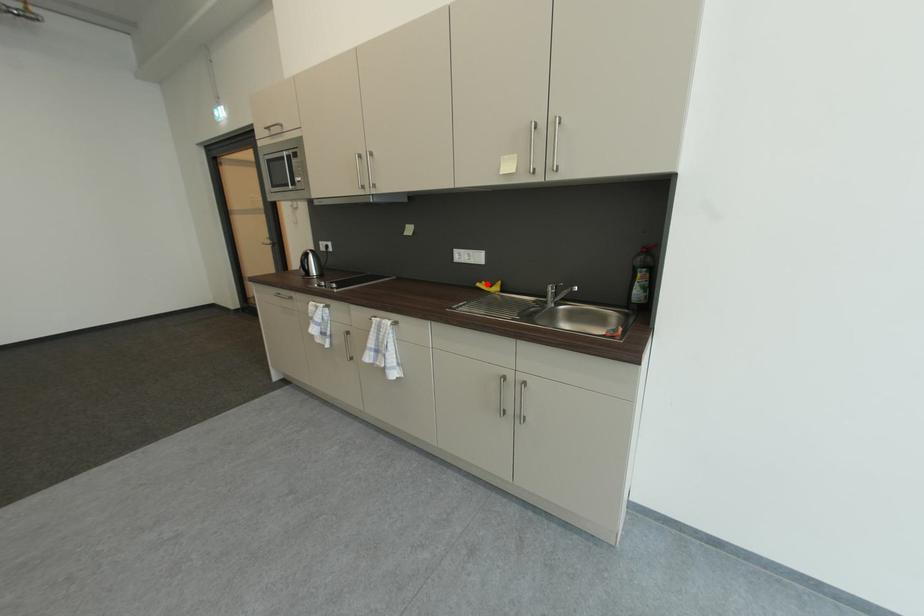
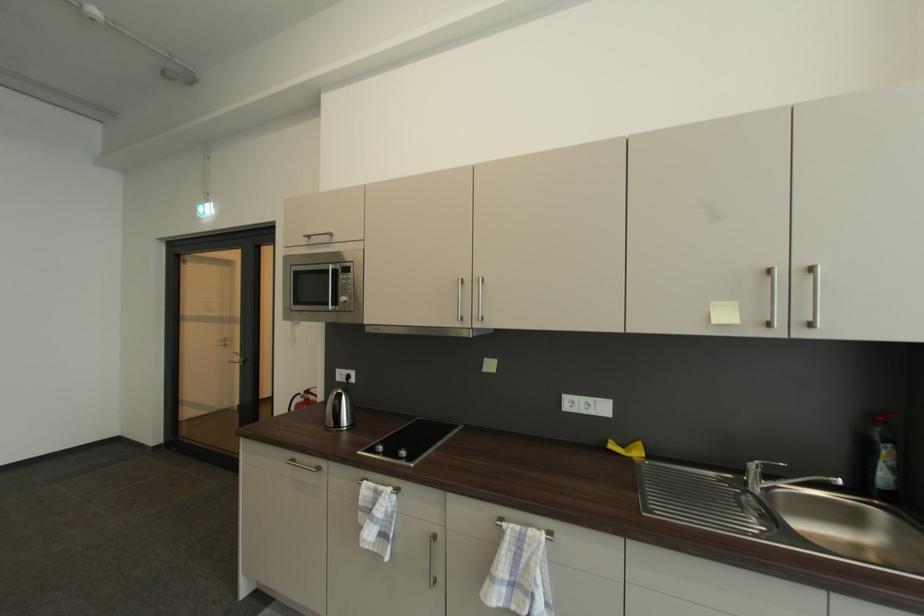
Locate, in the second image, the point that corresponds to the highlighted location in the first image.

(613, 443)